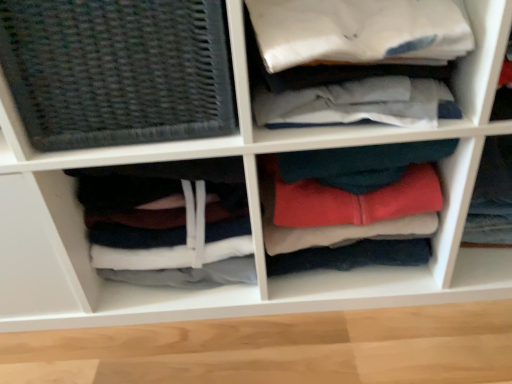
Question: From the image's perspective, is dark gray woven mat at left on dark gray fabric at lower left, the 3th clothing viewed from the right?

Choices:
 (A) no
 (B) yes

Answer: (B)

Question: Could you tell me if dark gray woven mat at left is facing dark gray fabric at lower left, which ranks as the 1th clothing in left-to-right order?

Choices:
 (A) no
 (B) yes

Answer: (A)

Question: Would you say dark gray woven mat at left is outside dark gray fabric at lower left, the 3th clothing viewed from the right?

Choices:
 (A) no
 (B) yes

Answer: (B)

Question: Is dark gray woven mat at left further to the viewer compared to dark gray fabric at lower left, which ranks as the 1th clothing in left-to-right order?

Choices:
 (A) yes
 (B) no

Answer: (B)

Question: Is the depth of dark gray woven mat at left less than that of dark gray fabric at lower left, which ranks as the 1th clothing in left-to-right order?

Choices:
 (A) no
 (B) yes

Answer: (B)

Question: Does point (498, 206) appear closer or farther from the camera than point (339, 152)?

Choices:
 (A) closer
 (B) farther

Answer: (B)

Question: Is red fleece hoodie at center, the third clothing in the left-to-right sequence, spatially inside soft fleece hoodie at center, which is the second clothing from right to left, or outside of it?

Choices:
 (A) outside
 (B) inside

Answer: (A)

Question: From the image's perspective, relative to soft fleece hoodie at center, the 2th clothing from the left, is red fleece hoodie at center, marked as the 1th clothing in a right-to-left arrangement, above or below?

Choices:
 (A) below
 (B) above

Answer: (B)

Question: Considering their positions, is red fleece hoodie at center, marked as the 1th clothing in a right-to-left arrangement, located in front of or behind soft fleece hoodie at center, the 2th clothing from the left?

Choices:
 (A) front
 (B) behind

Answer: (B)

Question: Is point (304, 243) closer or farther from the camera than point (67, 105)?

Choices:
 (A) closer
 (B) farther

Answer: (B)

Question: From the image's perspective, is soft fleece hoodie at center, which is the second clothing from right to left, located above or below dark gray woven mat at left?

Choices:
 (A) below
 (B) above

Answer: (A)

Question: Is soft fleece hoodie at center, the 2th clothing from the left, inside the boundaries of dark gray woven mat at left, or outside?

Choices:
 (A) inside
 (B) outside

Answer: (B)

Question: In terms of height, does soft fleece hoodie at center, which is the second clothing from right to left, look taller or shorter compared to dark gray woven mat at left?

Choices:
 (A) tall
 (B) short

Answer: (A)

Question: Is red fleece hoodie at center, the third clothing in the left-to-right sequence, wider or thinner than dark gray fabric at lower left, which ranks as the 1th clothing in left-to-right order?

Choices:
 (A) wide
 (B) thin

Answer: (B)

Question: Considering their positions, is red fleece hoodie at center, marked as the 1th clothing in a right-to-left arrangement, located in front of or behind dark gray fabric at lower left, which ranks as the 1th clothing in left-to-right order?

Choices:
 (A) front
 (B) behind

Answer: (B)